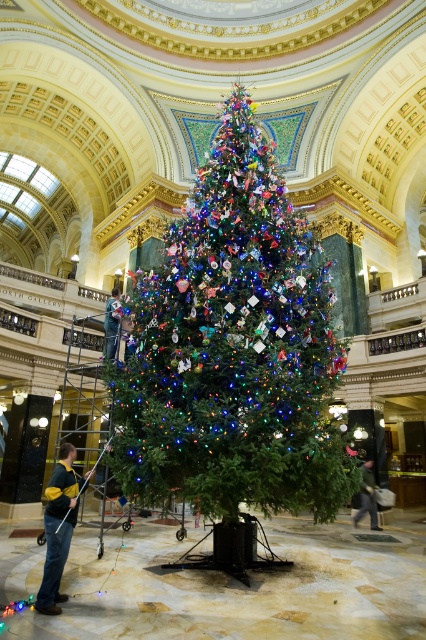
At what (x,y) coordinates should I click in order to perform the action: click on green matte christmas tree at center. Please return your answer as a coordinate pair (x, y). Looking at the image, I should click on (233, 349).

You are a GUI agent. You are given a task and a screenshot of the screen. Output one action in this format:
    pyautogui.click(x=<x>, y=<y>)
    Task: Click on the green matte christmas tree at center
    The width and height of the screenshot is (426, 640).
    Given the screenshot: What is the action you would take?
    pyautogui.click(x=233, y=349)

Image resolution: width=426 pixels, height=640 pixels. Identify the location of green matte christmas tree at center. (233, 349).

Is green matte christmas tree at center wider than green fabric at center?

Yes, green matte christmas tree at center is wider than green fabric at center.

Which of these two, green matte christmas tree at center or green fabric at center, stands taller?

green matte christmas tree at center

Who is more forward, [149,492] or [111,316]?

Point [149,492]

The image size is (426, 640). Find the location of `green matte christmas tree at center`. green matte christmas tree at center is located at coordinates (x=233, y=349).

How much distance is there between green fleece jacket at lower left and green fabric at center?

green fleece jacket at lower left is 13.41 meters from green fabric at center.

Which is more to the right, green fleece jacket at lower left or green fabric at center?

green fleece jacket at lower left

Where is `green fleece jacket at lower left`? green fleece jacket at lower left is located at coordinates (57, 525).